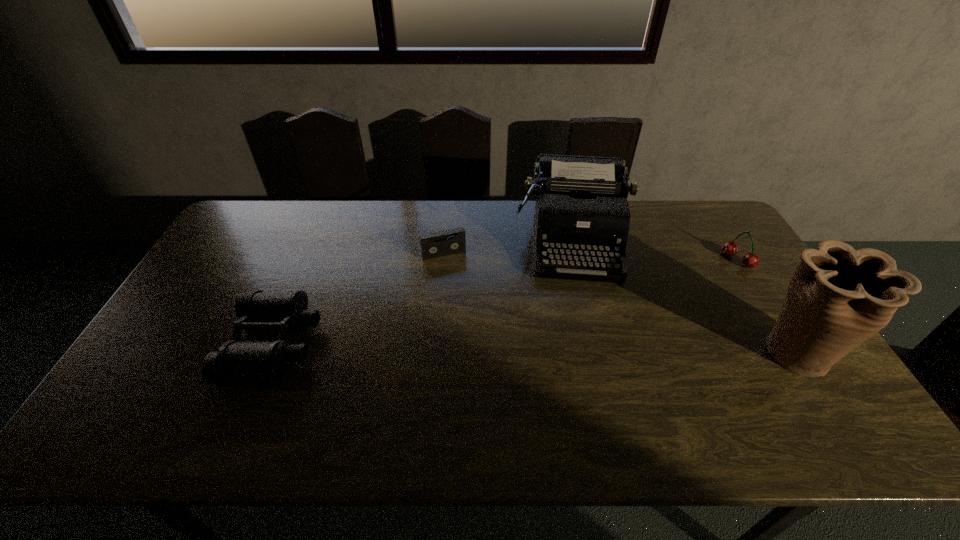
Identify the location of urn at the right edge. (838, 297).

This screenshot has width=960, height=540. I want to click on cherry present at the right edge, so click(750, 260).

This screenshot has height=540, width=960. I want to click on object that is at the near right corner, so click(838, 297).

Locate an element on the screen. free region at the far edge of the desktop is located at coordinates (406, 220).

Locate an element on the screen. This screenshot has height=540, width=960. vacant space at the near edge of the desktop is located at coordinates coord(400,379).

This screenshot has width=960, height=540. In the image, there is a desktop. Find the location of `vacant space at the left edge`. vacant space at the left edge is located at coordinates (192, 334).

This screenshot has width=960, height=540. I want to click on free spot at the right edge of the desktop, so click(x=693, y=244).

Identify the location of free region at the far left corner. The width and height of the screenshot is (960, 540). (252, 201).

You are a GUI agent. You are given a task and a screenshot of the screen. Output one action in this format:
    pyautogui.click(x=<x>, y=<y>)
    Task: Click on the free area in between the third object from right to left and the leftmost object
    The width and height of the screenshot is (960, 540).
    Given the screenshot: What is the action you would take?
    pyautogui.click(x=423, y=293)

Locate an element on the screen. free point between the binoculars and the tallest object is located at coordinates (535, 349).